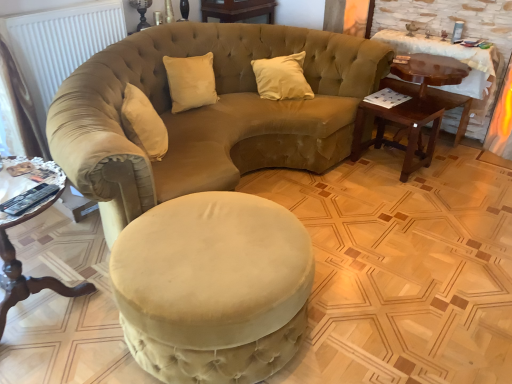
At what (x,y) coordinates should I click in order to perform the action: click on free space below wooden round table at lower left, the 3th table from the back (from a real-world perspective). Please return your answer as a coordinate pair (x, y). Looking at the image, I should click on (44, 317).